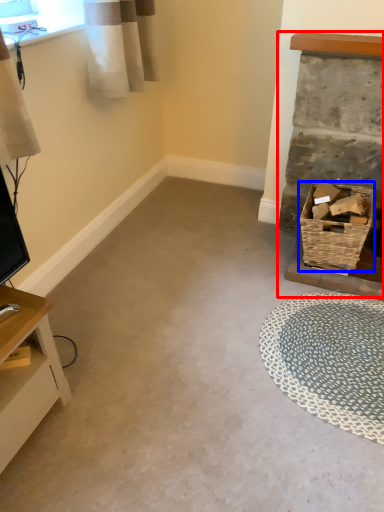
Question: Among these objects, which one is nearest to the camera, fireplace (highlighted by a red box) or basket (highlighted by a blue box)?

Choices:
 (A) fireplace
 (B) basket

Answer: (A)